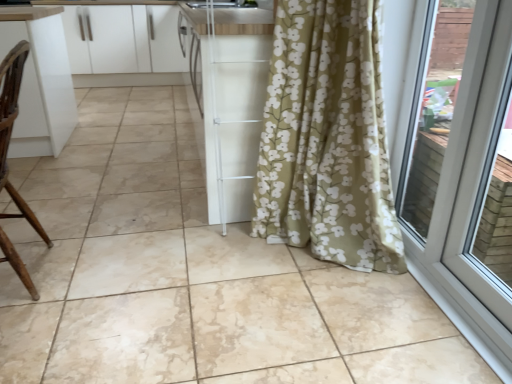
Image resolution: width=512 pixels, height=384 pixels. I want to click on vacant area that lies to the right of brown wood chair at left, so click(x=118, y=276).